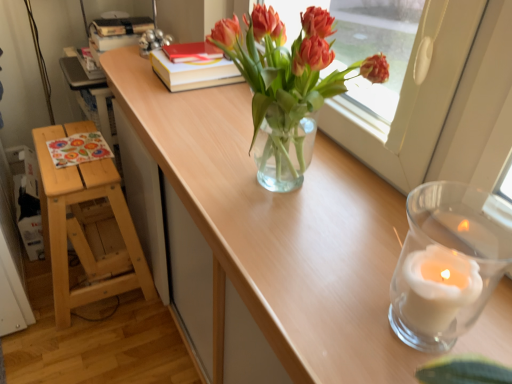
Question: Considering their positions, is natural wood stool at left located in front of or behind hardcover book at center, marked as the 1th book in a bottom-to-top arrangement?

Choices:
 (A) front
 (B) behind

Answer: (A)

Question: Is natural wood stool at left situated inside hardcover book at center, marked as the 1th book in a bottom-to-top arrangement, or outside?

Choices:
 (A) inside
 (B) outside

Answer: (B)

Question: Considering the real-world distances, which object is closest to the transparent glass candle at right?

Choices:
 (A) hardcover book at center, the second book positioned from the top
 (B) red matte book at upper center, arranged as the second book when ordered from the bottom
 (C) translucent glass vase at center
 (D) natural wood stool at left
 (E) metallic silver table lamp at upper left

Answer: (C)

Question: Which object is positioned closest to the natural wood stool at left?

Choices:
 (A) transparent glass candle at right
 (B) hardcover book at center, the second book positioned from the top
 (C) metallic silver table lamp at upper left
 (D) red matte book at upper center, arranged as the second book when ordered from the bottom
 (E) clear wood table at center

Answer: (E)